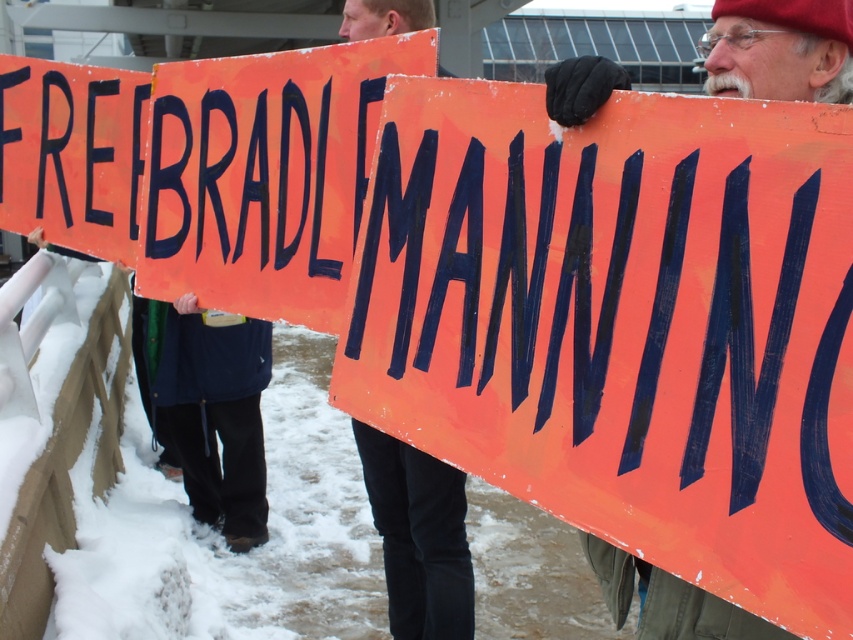
You are a photographer trying to capture a photo of the orange painted wood sign at center and the dark blue fleece pants at lower left. If you want to ensure both are fully visible in the frame, which object should you focus on first to avoid cropping?

The orange painted wood sign at center is not as tall as the dark blue fleece pants at lower left, so you should focus on the dark blue fleece pants at lower left first to ensure it fits entirely in the frame.

You are organizing a protest and need to arrange your orange painted wood signs for maximum visibility. Given that the orange painted wood sign at center and the orange painted wood sign at upper left are available, which one should you place higher up to ensure it is seen from a distance?

The orange painted wood sign at center is taller than the orange painted wood sign at upper left, so placing the taller orange painted wood sign at center higher up would ensure better visibility from a distance.

You are a photographer trying to capture the orange painted wood sign at center and the matte orange sign at center in a single shot. Since you want both signs to be clearly visible, which sign should you focus on first to ensure proper depth of field?

The orange painted wood sign at center is located above the matte orange sign at center, so you should focus on the orange painted wood sign at center first as it is farther away to ensure both are in focus.